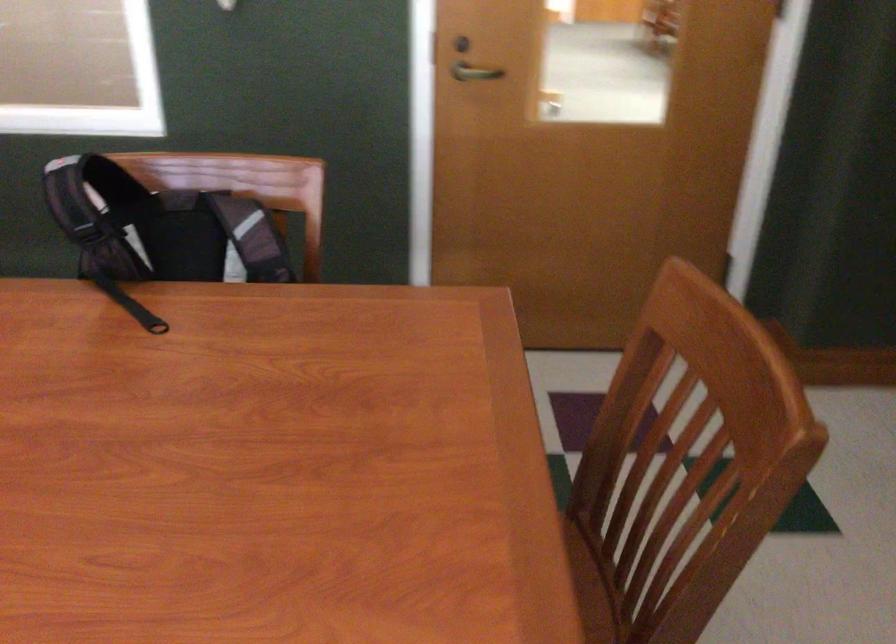
What do you see at coordinates (159, 228) in the screenshot? The image size is (896, 644). I see `a black backpack strap` at bounding box center [159, 228].